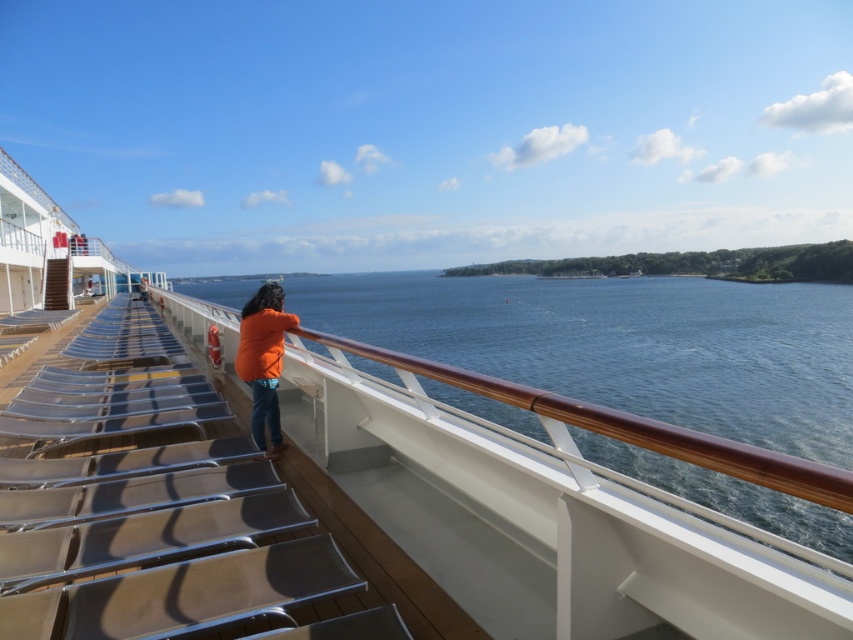
Question: Which point is farther from the camera taking this photo?

Choices:
 (A) tap(271, 420)
 (B) tap(816, 419)

Answer: (B)

Question: Can you confirm if blue water at center is bigger than orange fabric jacket at center?

Choices:
 (A) no
 (B) yes

Answer: (B)

Question: Which object is farther from the camera taking this photo?

Choices:
 (A) orange fabric jacket at center
 (B) blue water at center

Answer: (A)

Question: Can you confirm if blue water at center is positioned to the right of orange fabric jacket at center?

Choices:
 (A) yes
 (B) no

Answer: (A)

Question: Is blue water at center to the right of orange fabric jacket at center from the viewer's perspective?

Choices:
 (A) yes
 (B) no

Answer: (A)

Question: Which point is farther from the camera taking this photo?

Choices:
 (A) pyautogui.click(x=467, y=300)
 (B) pyautogui.click(x=257, y=326)

Answer: (A)